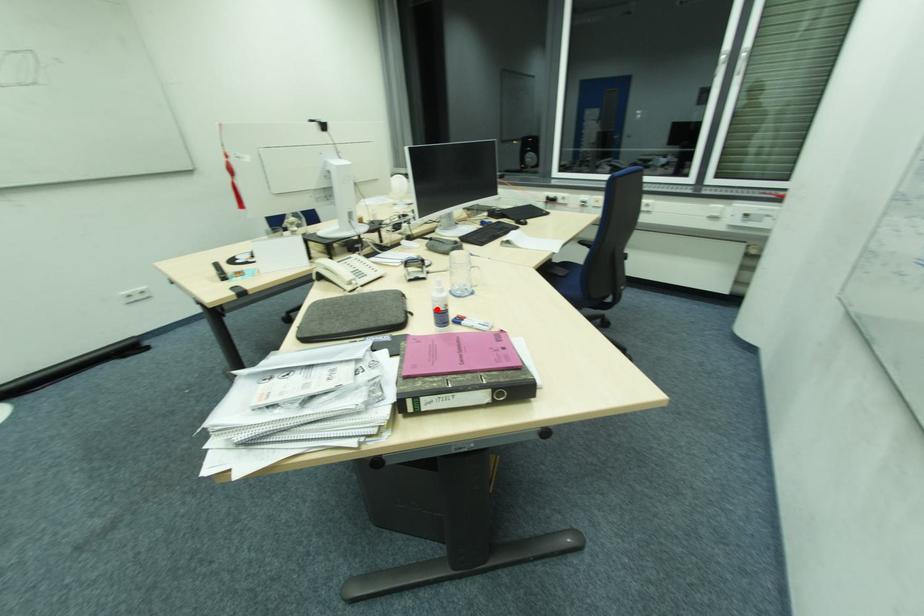
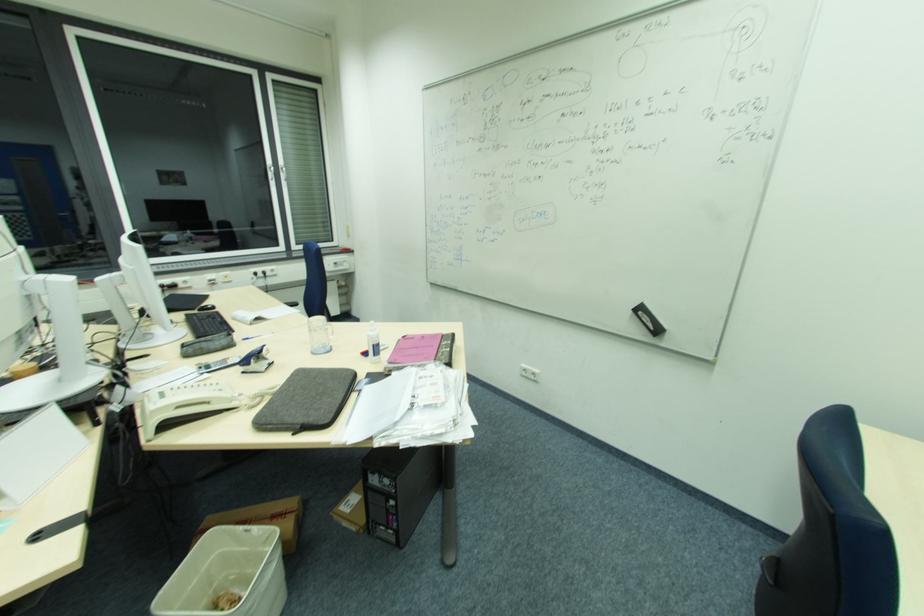
Where in the second image is the point corresponding to the highlighted location from the first image?

(375, 345)